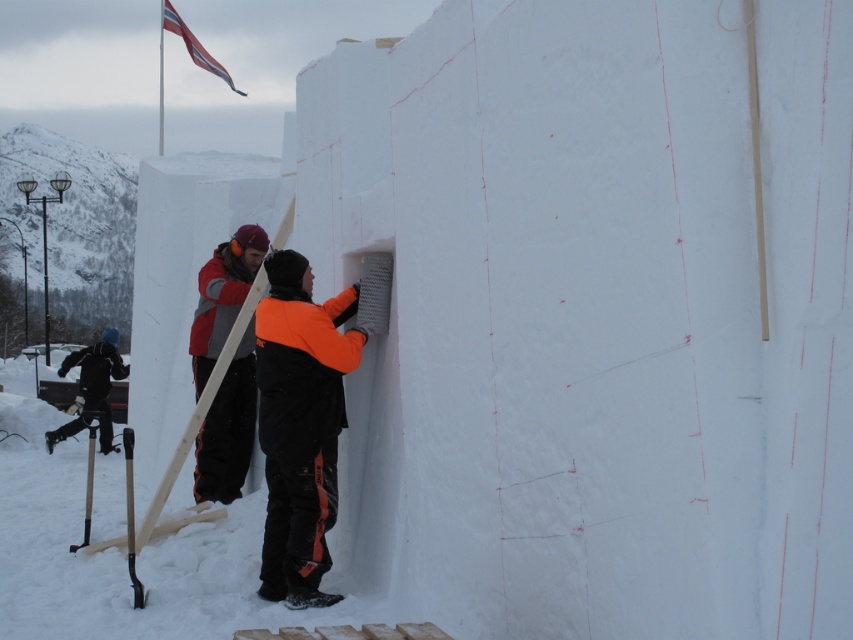
Question: Observing the image, what is the correct spatial positioning of orange fleece jacket at center in reference to black snowsuit at lower left?

Choices:
 (A) left
 (B) right

Answer: (B)

Question: Considering the relative positions of red jacket at center and red fabric flag at upper left in the image provided, where is red jacket at center located with respect to red fabric flag at upper left?

Choices:
 (A) above
 (B) below

Answer: (B)

Question: Which of the following is the closest to the observer?

Choices:
 (A) red fabric flag at upper left
 (B) orange fleece jacket at center
 (C) red jacket at center
 (D) black snowsuit at lower left

Answer: (B)

Question: Which of these objects is positioned farthest from the black snowsuit at lower left?

Choices:
 (A) red fabric flag at upper left
 (B) orange fleece jacket at center
 (C) red jacket at center

Answer: (B)

Question: Considering the relative positions of black snowsuit at lower left and red fabric flag at upper left in the image provided, where is black snowsuit at lower left located with respect to red fabric flag at upper left?

Choices:
 (A) right
 (B) left

Answer: (A)

Question: Which object is the closest to the red jacket at center?

Choices:
 (A) red fabric flag at upper left
 (B) orange fleece jacket at center
 (C) black snowsuit at lower left

Answer: (B)